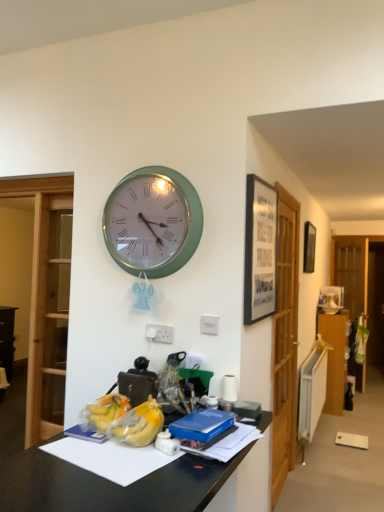
Question: Should I look upward or downward to see black matte picture frame at upper right, placed as the first picture frame when sorted from front to back?

Choices:
 (A) up
 (B) down

Answer: (A)

Question: Can you confirm if wooden glass door at center, which appears as the second glass door when viewed from the back, is positioned to the right of blue matte book at center?

Choices:
 (A) no
 (B) yes

Answer: (B)

Question: From the image's perspective, does wooden glass door at center, which appears as the second glass door when viewed from the back, appear higher than blue matte book at center?

Choices:
 (A) yes
 (B) no

Answer: (B)

Question: Can you confirm if wooden glass door at center, which is the 1th glass door from front to back, is thinner than blue matte book at center?

Choices:
 (A) no
 (B) yes

Answer: (B)

Question: Considering the relative sizes of wooden glass door at center, which is the 1th glass door from front to back, and blue matte book at center in the image provided, is wooden glass door at center, which is the 1th glass door from front to back, shorter than blue matte book at center?

Choices:
 (A) no
 (B) yes

Answer: (A)

Question: From a real-world perspective, is wooden glass door at center, marked as the 2th glass door in a right-to-left arrangement, on top of blue matte book at center?

Choices:
 (A) no
 (B) yes

Answer: (B)

Question: Is there a large distance between wooden glass door at center, the first glass door viewed from the left, and blue matte book at center?

Choices:
 (A) yes
 (B) no

Answer: (A)

Question: Does translucent plastic bananas at center have a lesser height compared to green metallic wall clock at upper center?

Choices:
 (A) no
 (B) yes

Answer: (B)

Question: Considering the relative positions of translucent plastic bananas at center and green metallic wall clock at upper center in the image provided, is translucent plastic bananas at center to the left of green metallic wall clock at upper center from the viewer's perspective?

Choices:
 (A) no
 (B) yes

Answer: (A)

Question: From the image's perspective, is translucent plastic bananas at center below green metallic wall clock at upper center?

Choices:
 (A) yes
 (B) no

Answer: (A)

Question: Does translucent plastic bananas at center have a lesser width compared to green metallic wall clock at upper center?

Choices:
 (A) yes
 (B) no

Answer: (B)

Question: Is translucent plastic bananas at center bigger than green metallic wall clock at upper center?

Choices:
 (A) yes
 (B) no

Answer: (B)

Question: Could you tell me if translucent plastic bananas at center is turned towards green metallic wall clock at upper center?

Choices:
 (A) no
 (B) yes

Answer: (A)

Question: From the image's perspective, is matte black picture frame at upper right, which is the first picture frame in right-to-left order, beneath black matte picture frame at upper right, placed as the first picture frame when sorted from front to back?

Choices:
 (A) no
 (B) yes

Answer: (A)